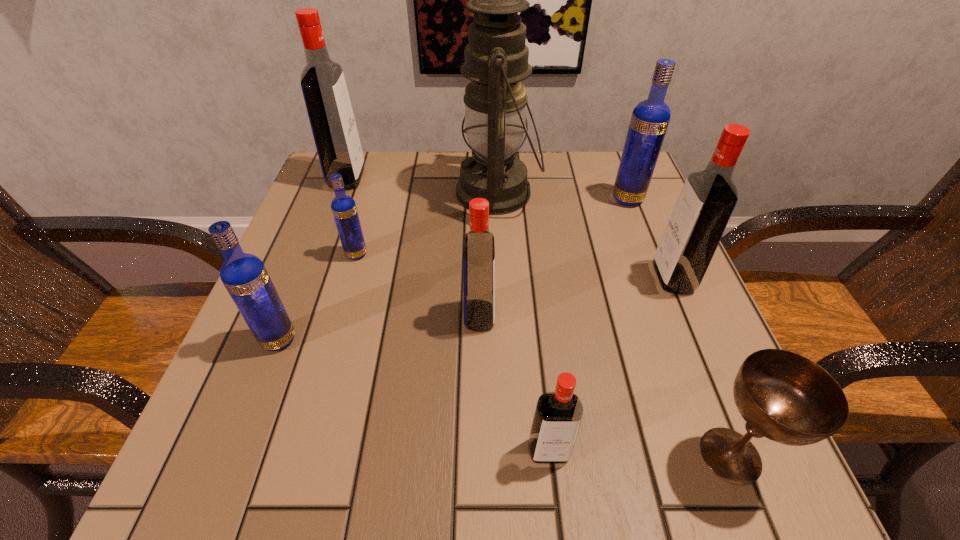
At what (x,y) coordinates should I click in order to perform the action: click on oil lamp. Please return your answer as a coordinate pair (x, y). Image resolution: width=960 pixels, height=540 pixels. Looking at the image, I should click on (496, 58).

The image size is (960, 540). Identify the location of the leftmost red vodka. (323, 84).

The image size is (960, 540). Identify the location of the farthest red vodka. point(323,84).

You are a GUI agent. You are given a task and a screenshot of the screen. Output one action in this format:
    pyautogui.click(x=<x>, y=<y>)
    Task: Click on the rightmost blue vodka
    
    Given the screenshot: What is the action you would take?
    pyautogui.click(x=650, y=118)

Find the location of a particular element. The width and height of the screenshot is (960, 540). the farthest blue vodka is located at coordinates (650, 118).

Where is `the rightmost red vodka`? This screenshot has width=960, height=540. the rightmost red vodka is located at coordinates (707, 200).

Locate an element on the screen. Image resolution: width=960 pixels, height=540 pixels. the third smallest red vodka is located at coordinates (707, 200).

The width and height of the screenshot is (960, 540). I want to click on the second smallest blue vodka, so click(244, 275).

Where is `the leftmost blue vodka`? The width and height of the screenshot is (960, 540). the leftmost blue vodka is located at coordinates (244, 275).

Where is `the second nearest red vodka`? the second nearest red vodka is located at coordinates (479, 248).